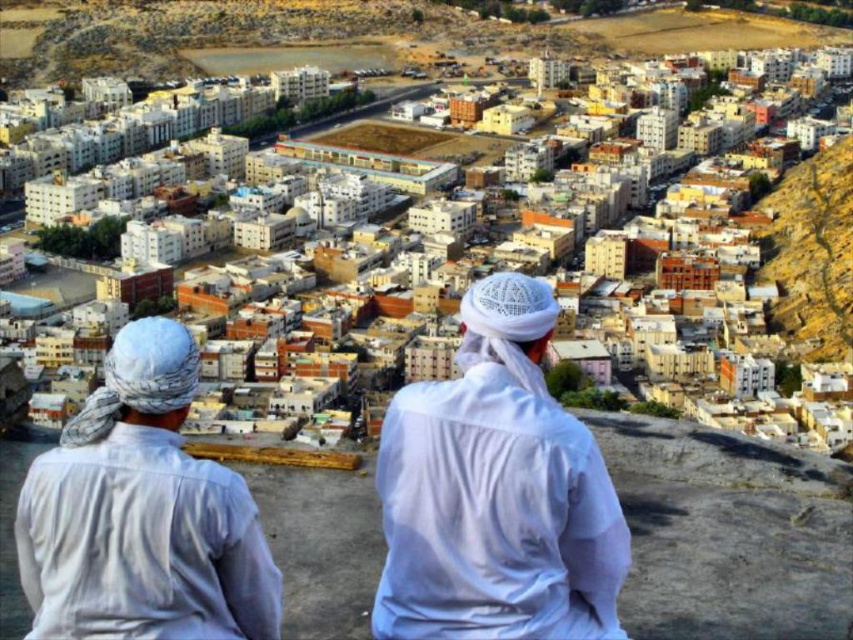
You are a traveler observing two people in the foreground of an urban scene. The first person is wearing a white cotton shirt at left, and the second is wearing white cotton clothing at center. From your perspective, which clothing item is located more to the left?

The white cotton shirt at left is more to the left than the white cotton clothing at center.

You are a tailor in this Middle Eastern city. You have two garments to work on today. The first is the white cotton robe at center, and the second is the white cotton shirt at left. A customer asks which garment requires more fabric to make. Which one do you tell them?

The white cotton robe at center requires more fabric than the white cotton shirt at left because it is bigger in size.